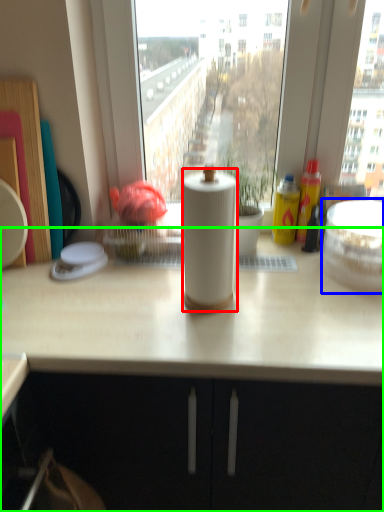
Question: Estimate the real-world distances between objects in this image. Which object is closer to paper towel (highlighted by a red box), appliance (highlighted by a blue box) or countertop (highlighted by a green box)?

Choices:
 (A) appliance
 (B) countertop

Answer: (B)